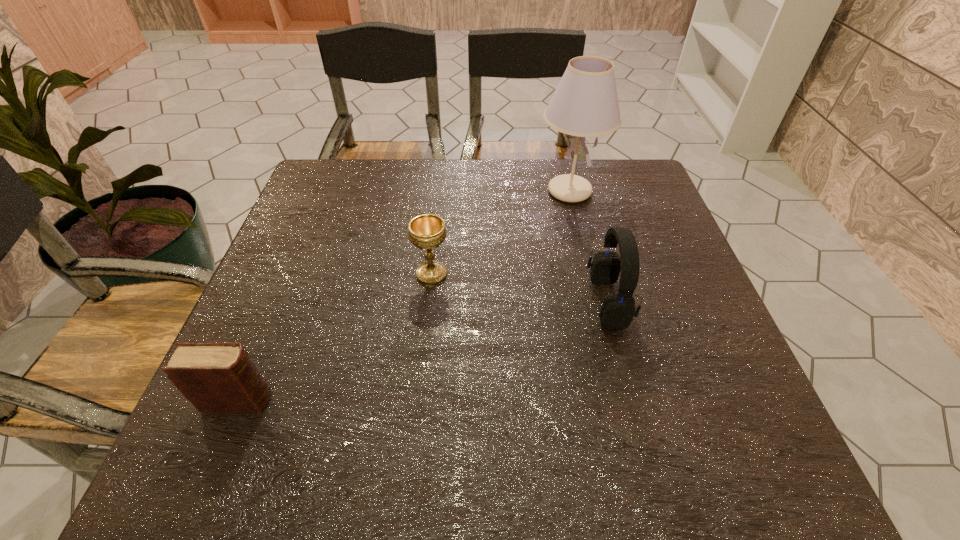
Image resolution: width=960 pixels, height=540 pixels. Identify the location of the farthest object. (585, 104).

Locate an element on the screen. Image resolution: width=960 pixels, height=540 pixels. the tallest object is located at coordinates pyautogui.click(x=585, y=104).

Locate an element on the screen. headset is located at coordinates (617, 311).

I want to click on the third object from right to left, so coord(426,231).

Find the location of a particular element. the leftmost object is located at coordinates (215, 377).

You are a GUI agent. You are given a task and a screenshot of the screen. Output one action in this format:
    pyautogui.click(x=<x>, y=<y>)
    Task: Click on the diary
    
    Given the screenshot: What is the action you would take?
    pyautogui.click(x=215, y=377)

Find the location of `vacant space located on the left of the tallest object`. vacant space located on the left of the tallest object is located at coordinates (445, 191).

This screenshot has height=540, width=960. Find the location of `vacant space located 0.290m on the headband of the headset`. vacant space located 0.290m on the headband of the headset is located at coordinates (455, 301).

This screenshot has width=960, height=540. Find the location of `vacant space located 0.130m on the headband of the headset`. vacant space located 0.130m on the headband of the headset is located at coordinates (529, 301).

The image size is (960, 540). Identify the location of vacant space situated on the headband of the headset. (516, 301).